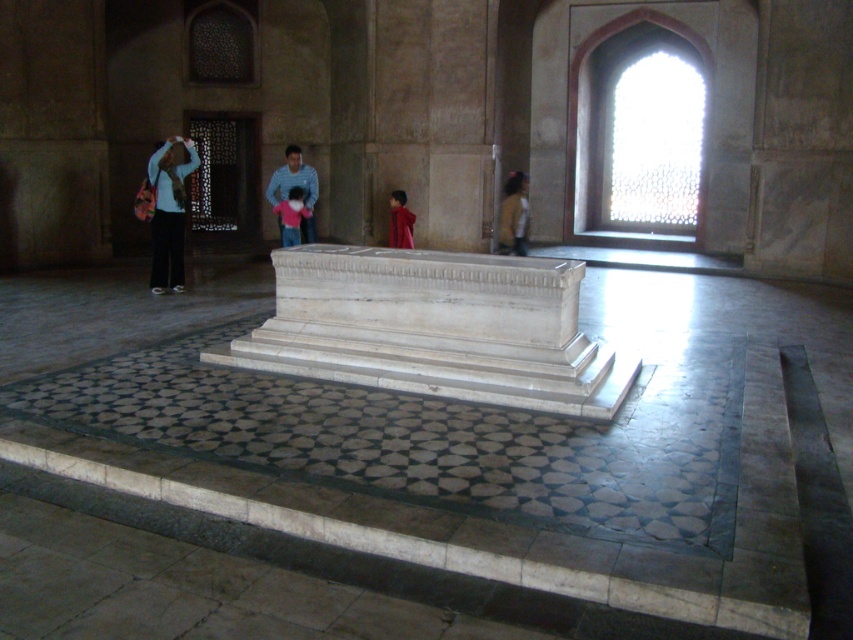
Question: Which of the following is the closest to the observer?

Choices:
 (A) yellow matte shirt at right
 (B) matte blue shirt at left
 (C) red velvet jacket at center

Answer: (B)

Question: Among these objects, which one is farthest from the camera?

Choices:
 (A) striped cotton shirt at center
 (B) matte blue shirt at left
 (C) yellow matte shirt at right

Answer: (C)

Question: Where is striped cotton shirt at center located in relation to yellow matte shirt at right in the image?

Choices:
 (A) below
 (B) above

Answer: (B)

Question: Where is striped cotton shirt at center located in relation to red velvet jacket at center in the image?

Choices:
 (A) above
 (B) below

Answer: (A)

Question: Can you confirm if striped cotton shirt at center is positioned above yellow matte shirt at right?

Choices:
 (A) yes
 (B) no

Answer: (A)

Question: Which of the following is the farthest from the observer?

Choices:
 (A) yellow matte shirt at right
 (B) matte blue shirt at left
 (C) striped cotton shirt at center
 (D) light blue shirt at center

Answer: (A)